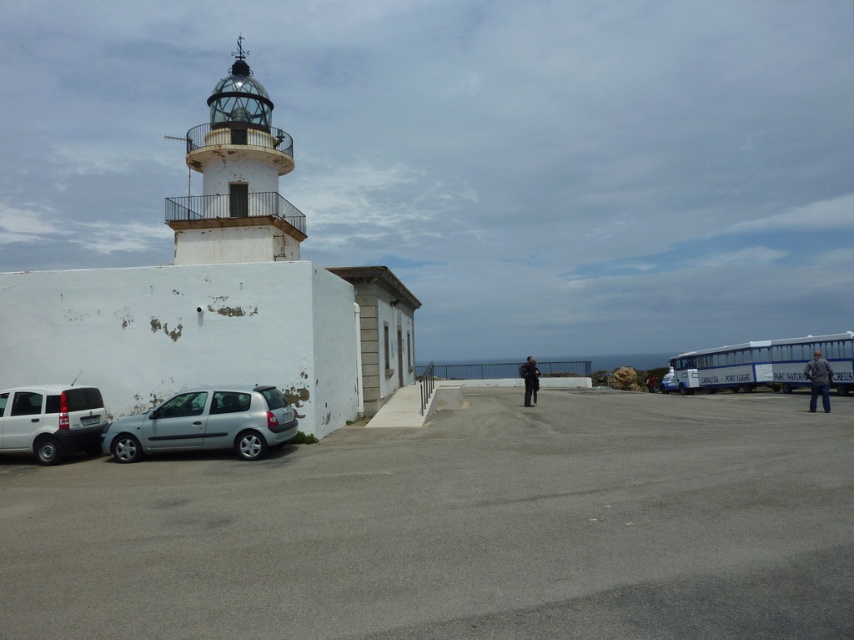
You are a tour guide leading visitors to the lighthouse. You need to park your white matte suv at lower left and silver metallic car at center in the parking area. Which car should you park closer to the lighthouse entrance to ensure both fit in the available space?

The white matte suv at lower left is smaller than the silver metallic car at center, so you should park the smaller white matte suv at lower left closer to the lighthouse entrance to allow enough space for the larger silver metallic car at center.